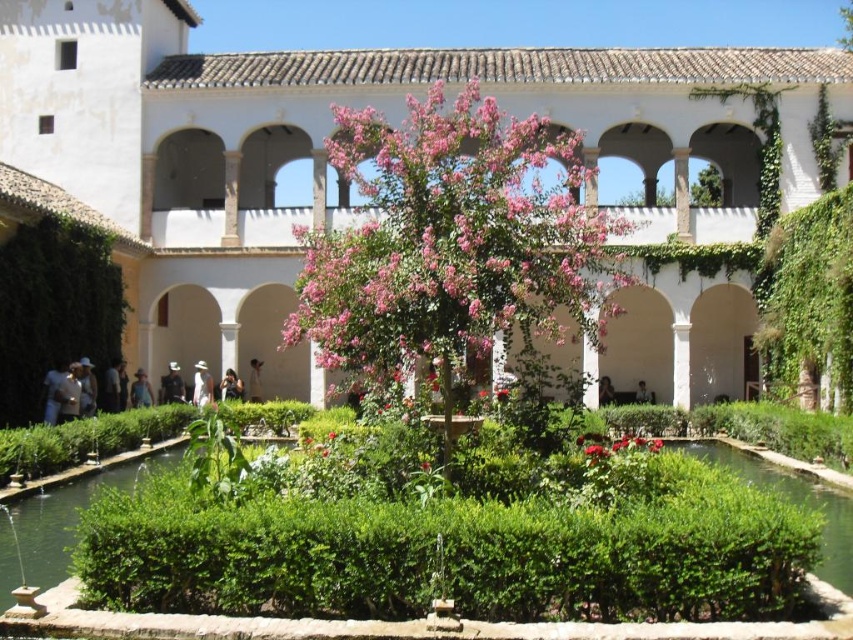
Does matte black camera at center have a lesser height compared to dark brown leather jacket at center?

Correct, matte black camera at center is not as tall as dark brown leather jacket at center.

Does matte black camera at center have a greater width compared to dark brown leather jacket at center?

Incorrect, matte black camera at center's width does not surpass dark brown leather jacket at center's.

Is point (239, 390) positioned in front of point (599, 384)?

Yes, point (239, 390) is closer to viewer.

Find the location of a particular element. This screenshot has height=640, width=853. matte black camera at center is located at coordinates (230, 385).

Consider the image. Is vivid red petals at center bigger than light brown leather hat at lower left?

Indeed, vivid red petals at center has a larger size compared to light brown leather hat at lower left.

Consider the image. Who is more distant from viewer, (637, 438) or (90, 401)?

Positioned behind is point (90, 401).

Which is behind, point (653, 451) or point (90, 372)?

The point (90, 372) is more distant.

Find the location of a particular element. vivid red petals at center is located at coordinates (614, 445).

Does point (846, 572) come in front of point (61, 365)?

Yes, it is in front of point (61, 365).

Who is more forward, (700, 456) or (62, 368)?

Point (62, 368) is in front.

Find the location of a particular element. This screenshot has width=853, height=640. green leafy pond at lower right is located at coordinates (791, 500).